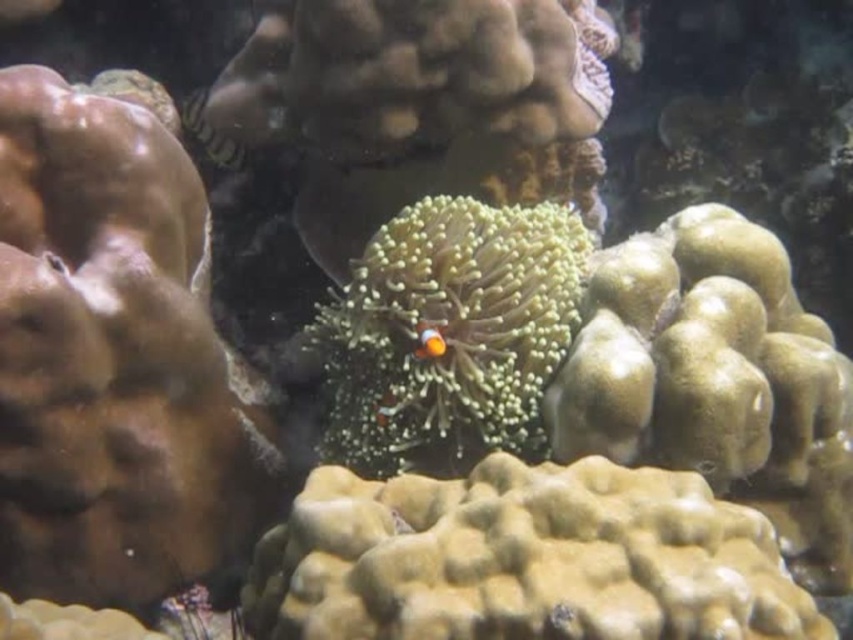
Does shiny green fish at upper left appear on the left side of bright orange clownfish at center?

Correct, you'll find shiny green fish at upper left to the left of bright orange clownfish at center.

Can you confirm if shiny green fish at upper left is positioned to the right of bright orange clownfish at center?

Incorrect, shiny green fish at upper left is not on the right side of bright orange clownfish at center.

Does point (225, 154) come in front of point (430, 332)?

No, (225, 154) is further to viewer.

Where is `shiny green fish at upper left`? The image size is (853, 640). shiny green fish at upper left is located at coordinates [x=207, y=131].

Does green fuzzy coral at center have a smaller size compared to shiny green fish at upper left?

Actually, green fuzzy coral at center might be larger than shiny green fish at upper left.

The height and width of the screenshot is (640, 853). What do you see at coordinates (450, 333) in the screenshot?
I see `green fuzzy coral at center` at bounding box center [450, 333].

The width and height of the screenshot is (853, 640). Identify the location of green fuzzy coral at center. (450, 333).

In the scene shown: Does green fuzzy coral at center appear on the right side of bright orange clownfish at center?

Indeed, green fuzzy coral at center is positioned on the right side of bright orange clownfish at center.

Does green fuzzy coral at center lie behind bright orange clownfish at center?

That is True.

Which is in front, point (428, 404) or point (416, 353)?

Point (416, 353)

In order to click on green fuzzy coral at center in this screenshot , I will do (x=450, y=333).